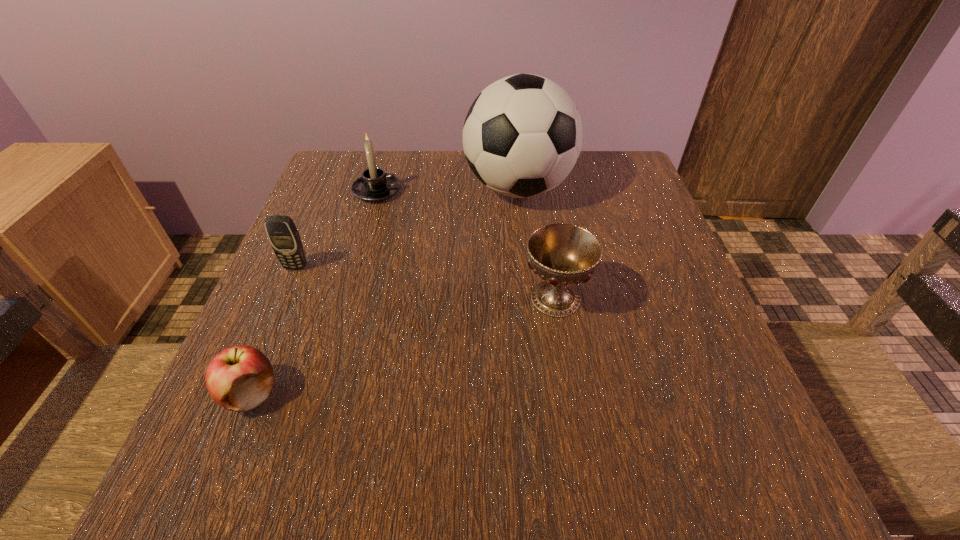
Find the location of a particular element. This screenshot has width=960, height=540. vacant space that satisfies the following two spatial constraints: 1. with a handle on the side of the third object from right to left; 2. on the front face of the third farthest object is located at coordinates (355, 267).

At what (x,y) coordinates should I click in order to perform the action: click on vacant space that satisfies the following two spatial constraints: 1. on the back side of the nearest object; 2. on the left side of the soccer ball. Please return your answer as a coordinate pair (x, y). The image size is (960, 540). Looking at the image, I should click on (335, 188).

The image size is (960, 540). Identify the location of free location that satisfies the following two spatial constraints: 1. with a handle on the side of the second tallest object; 2. on the front face of the cellular telephone. (355, 267).